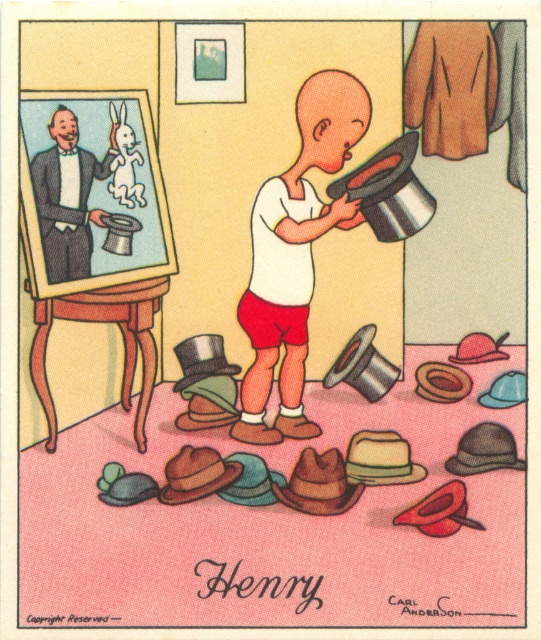
Question: Where is brushed wood easel at upper left located in relation to white matte shirt at center in the image?

Choices:
 (A) left
 (B) right

Answer: (A)

Question: Which of these objects is positioned closest to the brushed wood easel at upper left?

Choices:
 (A) shiny silver top hat at center
 (B) white matte shirt at center
 (C) smooth black suit at left

Answer: (C)

Question: Can you confirm if brushed wood easel at upper left is bigger than shiny silver top hat at center?

Choices:
 (A) yes
 (B) no

Answer: (A)

Question: Can you confirm if brushed wood easel at upper left is bigger than shiny silver top hat at center?

Choices:
 (A) yes
 (B) no

Answer: (A)

Question: Which point is closer to the camera?

Choices:
 (A) (74, 186)
 (B) (286, 204)

Answer: (A)

Question: Estimate the real-world distances between objects in this image. Which object is closer to the shiny silver top hat at center?

Choices:
 (A) smooth black suit at left
 (B) white matte shirt at center
 (C) brushed wood easel at upper left

Answer: (B)